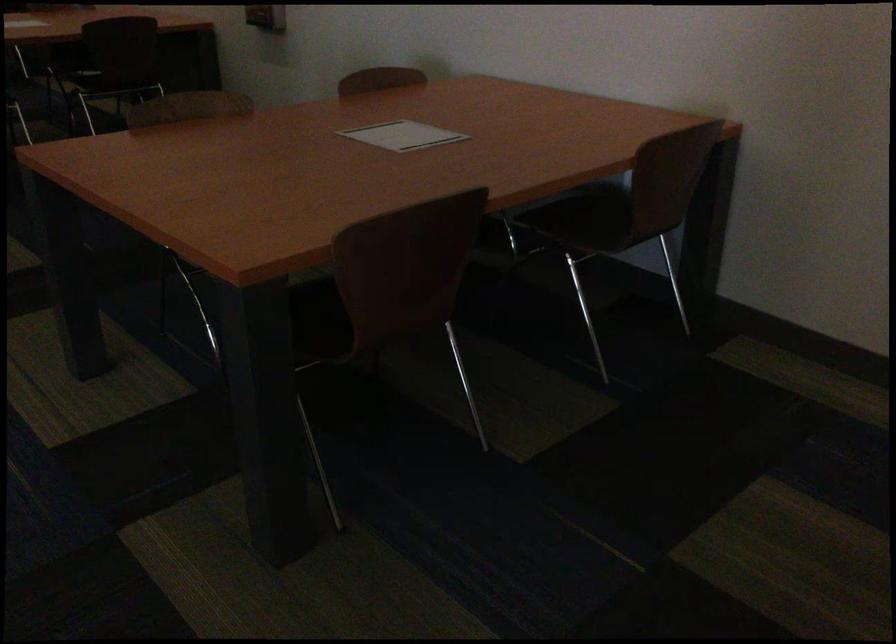
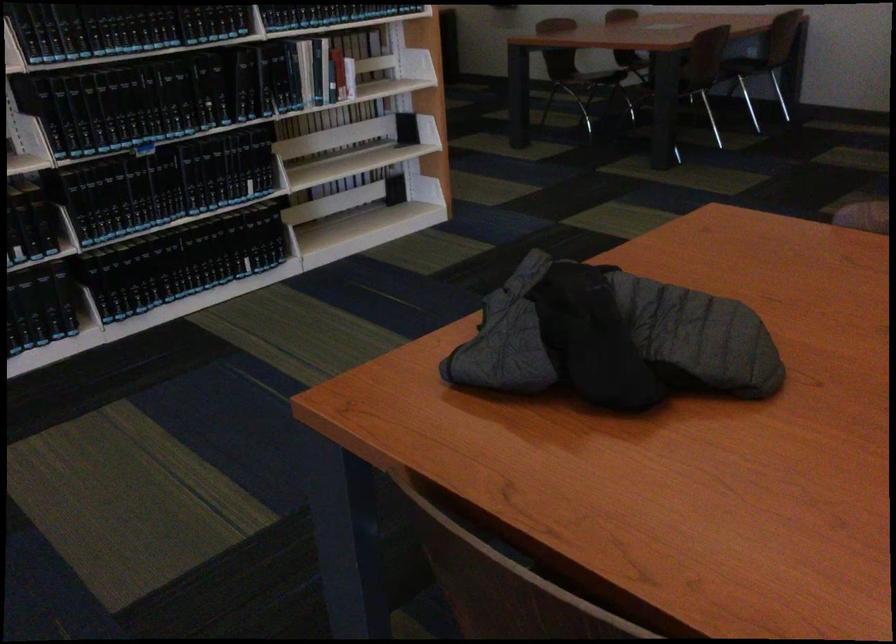
Locate, in the second image, the point that corresponds to point (625, 247) in the first image.

(743, 58)